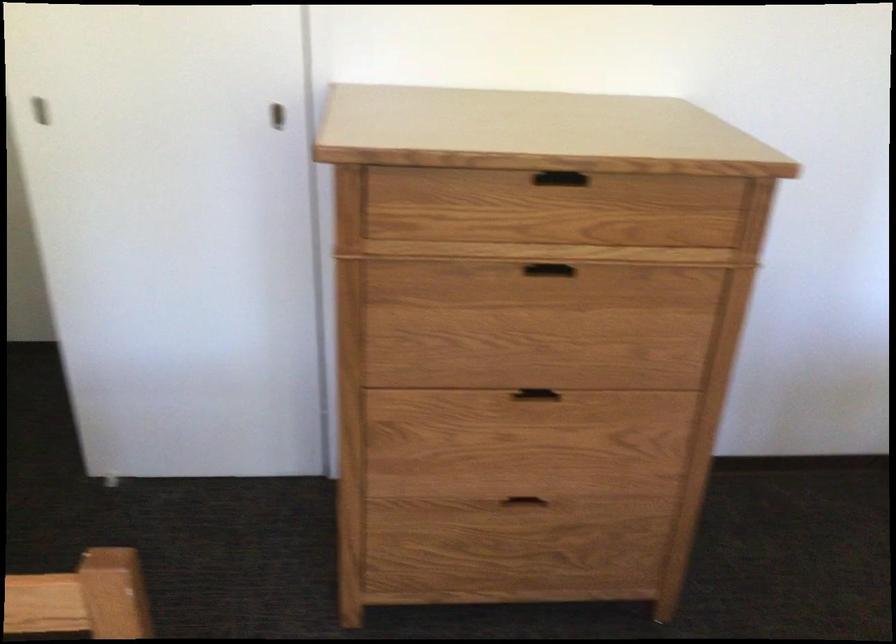
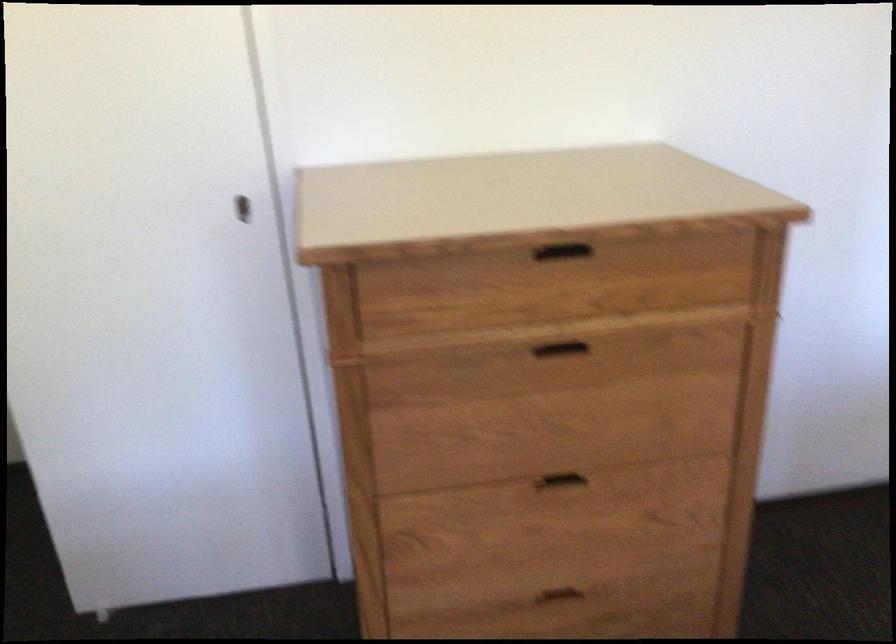
Question: The images are taken continuously from a first-person perspective. In which direction is your viewpoint rotating?

Choices:
 (A) Left
 (B) Right
 (C) Up
 (D) Down

Answer: (C)